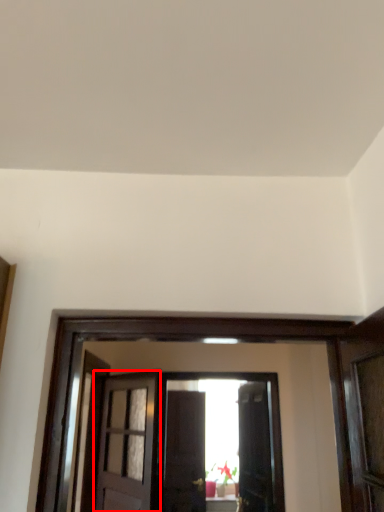
Question: In this image, where is door (annotated by the red box) located relative to door?

Choices:
 (A) right
 (B) left

Answer: (B)